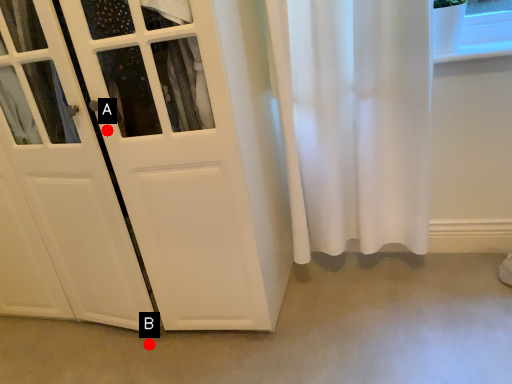
Question: Two points are circled on the image, labeled by A and B beside each circle. Which point is farther to the camera?

Choices:
 (A) A is further
 (B) B is further

Answer: (B)